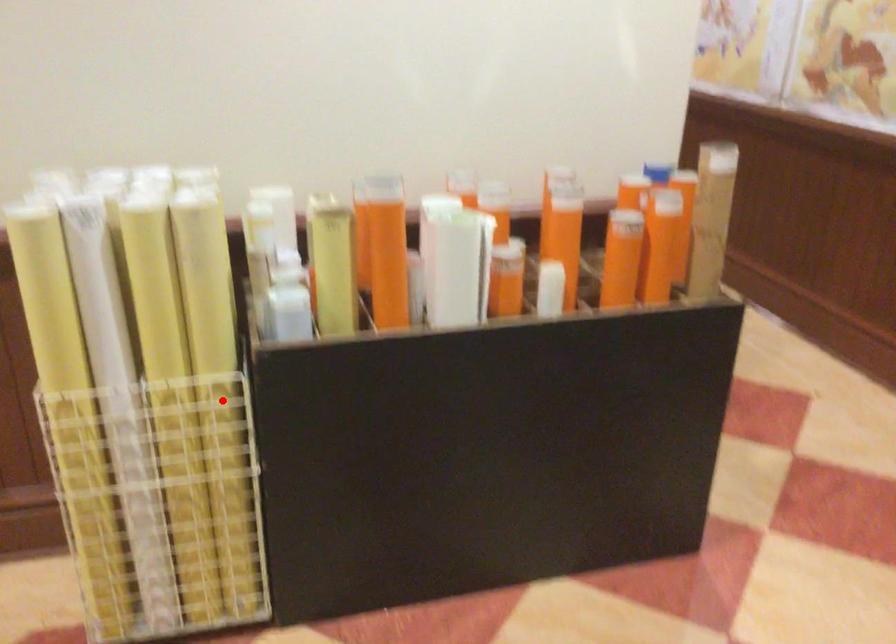
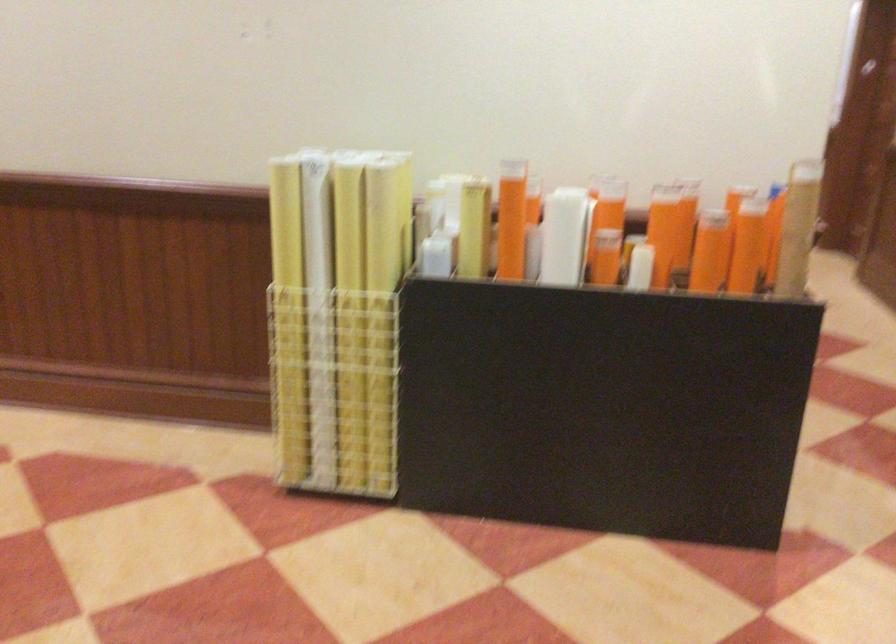
Locate, in the second image, the point that corresponds to the highlighted location in the first image.

(382, 314)